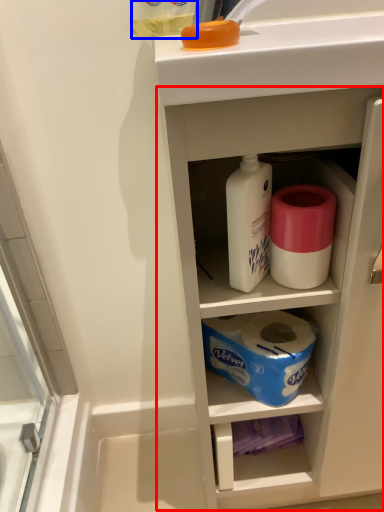
Question: Which point is closer to the camera, cabinetry (highlighted by a red box) or bottle (highlighted by a blue box)?

Choices:
 (A) cabinetry
 (B) bottle

Answer: (A)